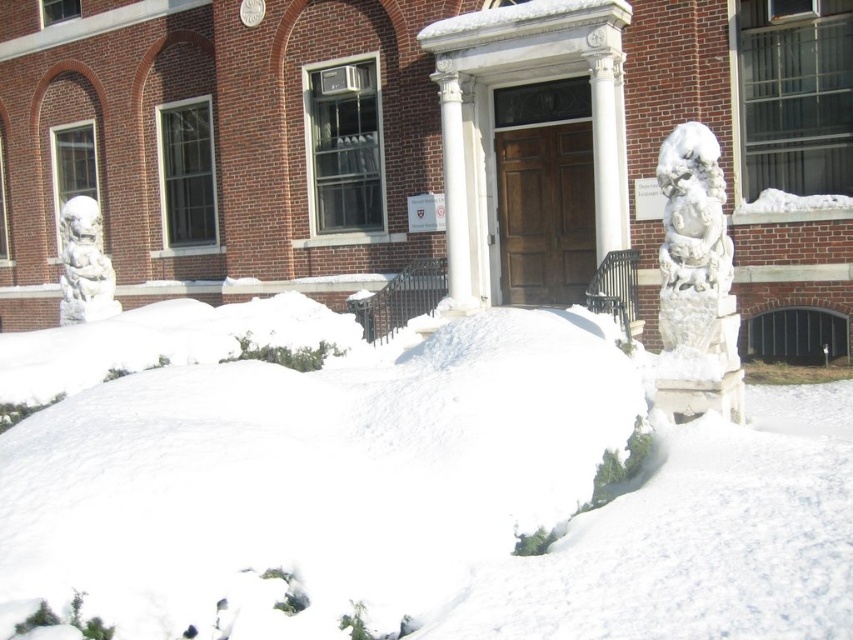
Who is more distant from viewer, (517, 19) or (96, 211)?

Positioned behind is point (96, 211).

Describe the element at coordinates (494, 124) in the screenshot. This screenshot has height=640, width=853. I see `white marble columns at center` at that location.

From the picture: Who is more distant from viewer, (496, 264) or (74, 308)?

The point (496, 264) is more distant.

At what (x,y) coordinates should I click in order to perform the action: click on white marble columns at center. Please return your answer as a coordinate pair (x, y). The image size is (853, 640). Looking at the image, I should click on (494, 124).

Can you confirm if white stone lion at left is smaller than white marble column at center?

Yes, white stone lion at left is smaller than white marble column at center.

Between white stone lion at left and white marble column at center, which one has more height?

white marble column at center is taller.

What are the coordinates of `white stone lion at left` in the screenshot? It's located at (84, 264).

At what (x,y) coordinates should I click in order to perform the action: click on white stone lion at left. Please return your answer as a coordinate pair (x, y). This screenshot has height=640, width=853. Looking at the image, I should click on (84, 264).

The width and height of the screenshot is (853, 640). What do you see at coordinates (695, 282) in the screenshot?
I see `white marble lion at right` at bounding box center [695, 282].

Identify the location of white marble lion at right. (695, 282).

Is point (689, 140) in front of point (74, 246)?

Yes, it is in front of point (74, 246).

Locate an element on the screen. The image size is (853, 640). white marble lion at right is located at coordinates (695, 282).